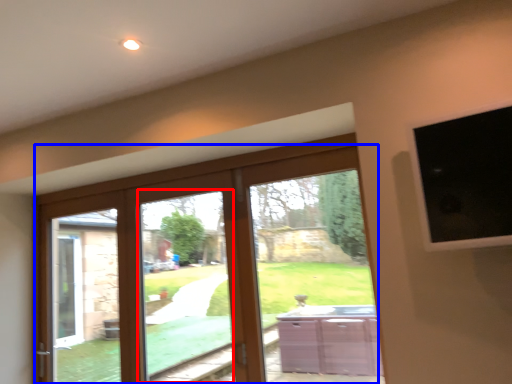
Question: Which object is closer to the camera taking this photo, window (highlighted by a red box) or door (highlighted by a blue box)?

Choices:
 (A) window
 (B) door

Answer: (B)